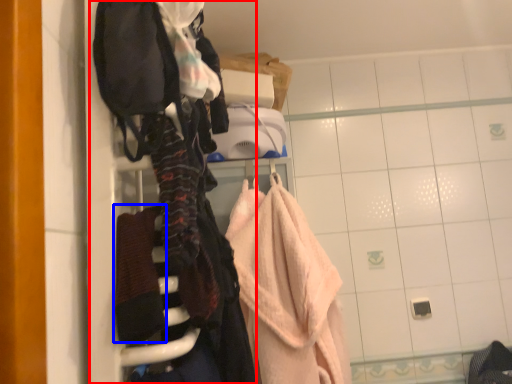
Question: Which of the following is the closest to the observer, closet (highlighted by a red box) or bath towel (highlighted by a blue box)?

Choices:
 (A) closet
 (B) bath towel

Answer: (A)